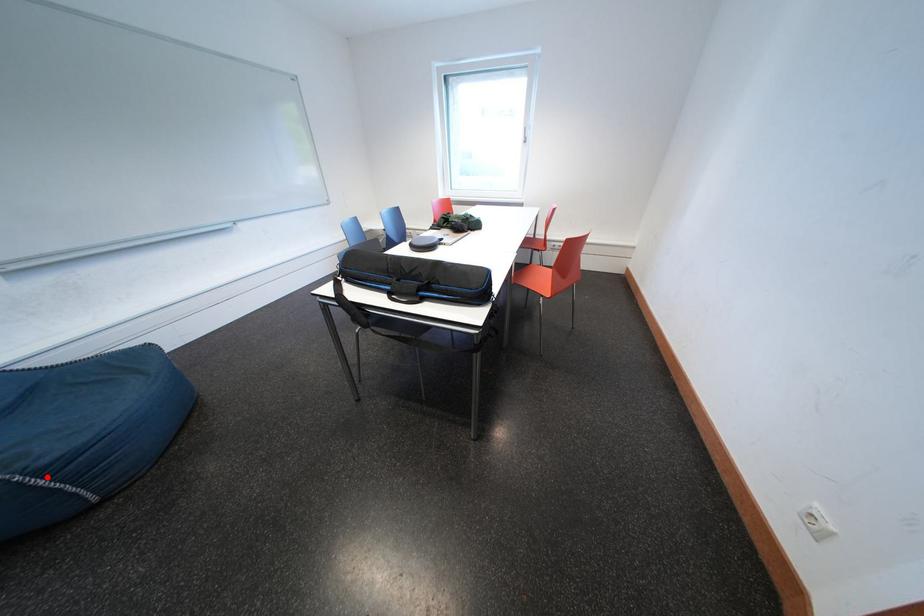
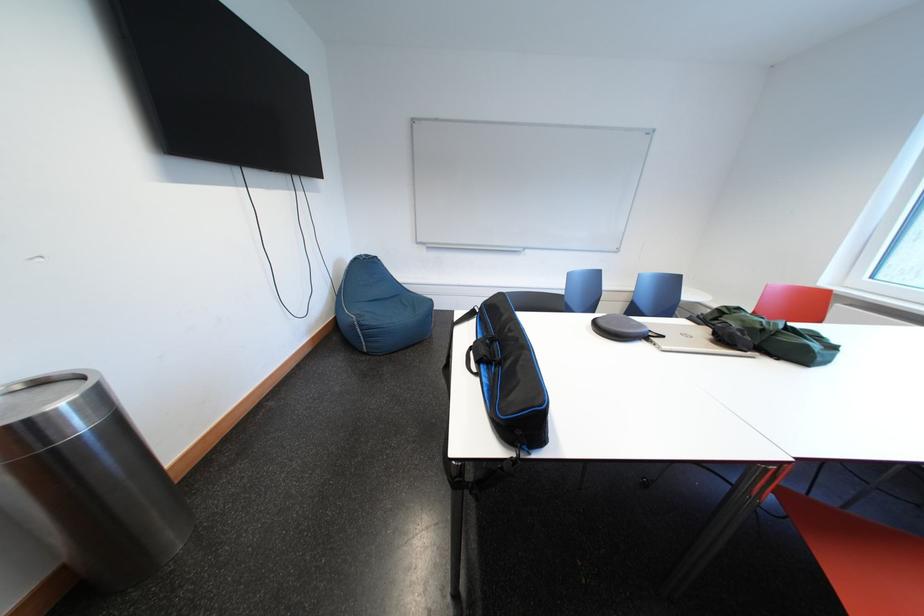
Question: I am providing you with two images of the same scene from different viewpoints. Given a red point in image1, look at the same physical point in image2. Is it:

Choices:
 (A) Closer to the viewpoint
 (B) Farther from the viewpoint

Answer: (A)